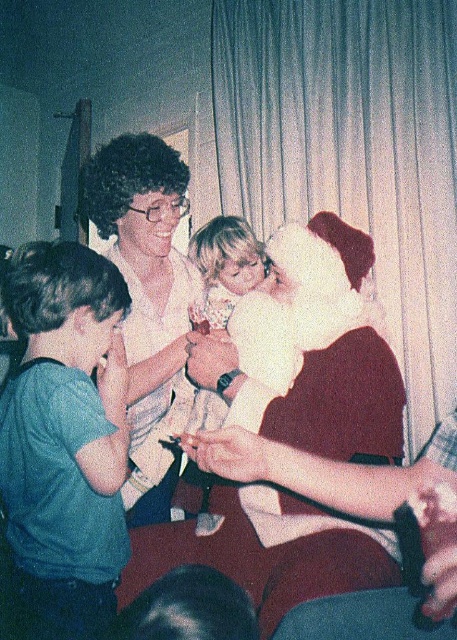
Question: Can you confirm if white matte shirt at center is positioned above smooth white dress at center?

Choices:
 (A) yes
 (B) no

Answer: (A)

Question: Where is white matte shirt at center located in relation to smooth white dress at center in the image?

Choices:
 (A) below
 (B) above

Answer: (B)

Question: Which of the following is the closest to the observer?

Choices:
 (A) white matte shirt at center
 (B) smooth white dress at center

Answer: (A)

Question: Among these points, which one is nearest to the camera?

Choices:
 (A) (211, 298)
 (B) (117, 240)

Answer: (B)

Question: Is white matte shirt at center thinner than smooth white dress at center?

Choices:
 (A) no
 (B) yes

Answer: (B)